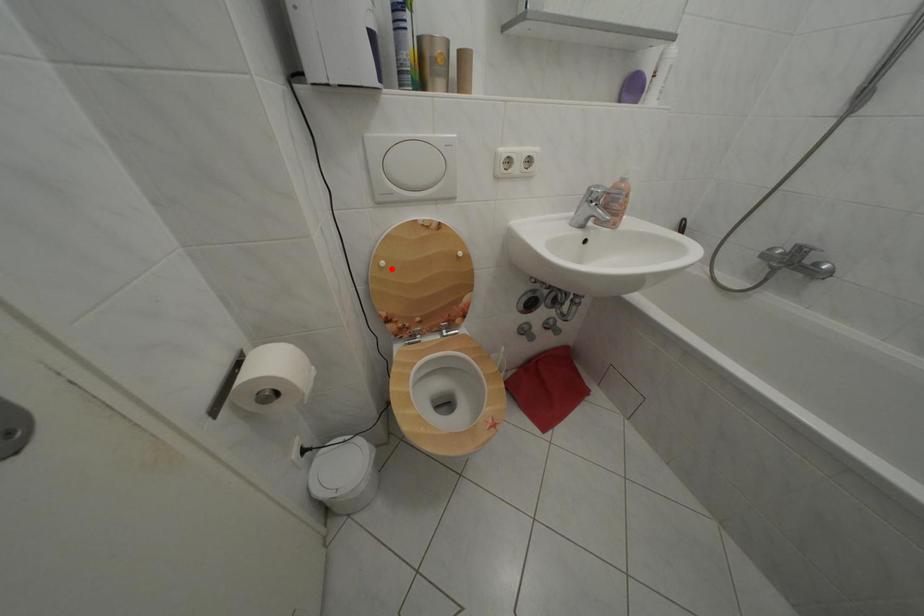
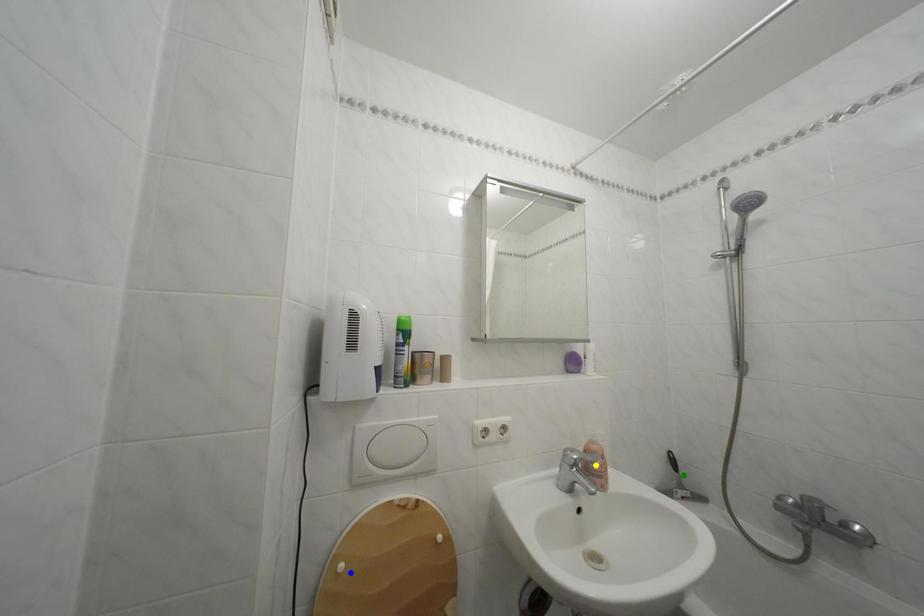
Question: I am providing you with two images of the same scene from different viewpoints. A red point is marked on the first image. You are given multiple points on the second image. Which point in image 2 is actually the same real-world point as the red point in image 1?

Choices:
 (A) blue point
 (B) yellow point
 (C) green point

Answer: (A)